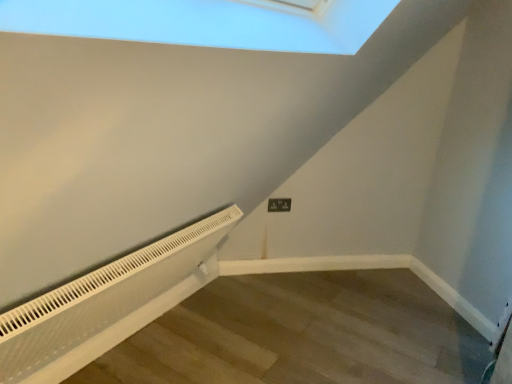
This screenshot has height=384, width=512. What do you see at coordinates (106, 300) in the screenshot?
I see `white textured radiator at lower left` at bounding box center [106, 300].

Locate an element on the screen. This screenshot has height=384, width=512. white textured radiator at lower left is located at coordinates (106, 300).

In order to face white plastic electric outlet at center, should I rotate leftwards or rightwards?

Rotate right and turn 3.498 degrees.

Describe the element at coordinates (279, 205) in the screenshot. I see `white plastic electric outlet at center` at that location.

Find the location of a particular element. The width and height of the screenshot is (512, 384). white plastic electric outlet at center is located at coordinates (279, 205).

Identify the location of white textured radiator at lower left. (106, 300).

From the picture: Considering the positions of objects white plastic electric outlet at center and white textured radiator at lower left in the image provided, who is more to the right, white plastic electric outlet at center or white textured radiator at lower left?

Positioned to the right is white plastic electric outlet at center.

Based on the photo, in the image, is white plastic electric outlet at center positioned in front of or behind white textured radiator at lower left?

In the image, white plastic electric outlet at center appears behind white textured radiator at lower left.

Considering the positions of point (278, 202) and point (106, 344), is point (278, 202) closer or farther from the camera than point (106, 344)?

Clearly, point (278, 202) is more distant from the camera than point (106, 344).

From the image's perspective, which is above, white plastic electric outlet at center or white textured radiator at lower left?

From the image's view, white plastic electric outlet at center is above.

From a real-world perspective, is white plastic electric outlet at center positioned above or below white textured radiator at lower left?

In terms of real-world spatial position, white plastic electric outlet at center is above white textured radiator at lower left.

Considering the sizes of objects white plastic electric outlet at center and white textured radiator at lower left in the image provided, who is wider, white plastic electric outlet at center or white textured radiator at lower left?

white textured radiator at lower left.

Between white plastic electric outlet at center and white textured radiator at lower left, which one has less height?

With less height is white plastic electric outlet at center.

Looking at this image, in terms of size, does white plastic electric outlet at center appear bigger or smaller than white textured radiator at lower left?

Clearly, white plastic electric outlet at center is smaller in size than white textured radiator at lower left.

Is white plastic electric outlet at center positioned beyond the bounds of white textured radiator at lower left?

Indeed, white plastic electric outlet at center is completely outside white textured radiator at lower left.

Is white plastic electric outlet at center next to white textured radiator at lower left?

They are not placed beside each other.

Is white plastic electric outlet at center positioned with its back to white textured radiator at lower left?

No, white plastic electric outlet at center is not facing the opposite direction of white textured radiator at lower left.

What's the angular difference between white plastic electric outlet at center and white textured radiator at lower left's facing directions?

There is a 45.2-degree angle between the facing directions of white plastic electric outlet at center and white textured radiator at lower left.

Looking at this image, could you measure the distance between white plastic electric outlet at center and white textured radiator at lower left?

The distance of white plastic electric outlet at center from white textured radiator at lower left is 1.13 meters.

Where is `electric outlet above the white textured radiator at lower left (from a real-world perspective)`? The height and width of the screenshot is (384, 512). electric outlet above the white textured radiator at lower left (from a real-world perspective) is located at coordinates (279, 205).

Considering the relative positions of white textured radiator at lower left and white plastic electric outlet at center in the image provided, is white textured radiator at lower left to the left of white plastic electric outlet at center from the viewer's perspective?

Yes, white textured radiator at lower left is to the left of white plastic electric outlet at center.

Does white textured radiator at lower left come behind white plastic electric outlet at center?

No, white textured radiator at lower left is closer to the viewer.

Considering the positions of point (201, 244) and point (286, 201), is point (201, 244) closer or farther from the camera than point (286, 201)?

Clearly, point (201, 244) is closer to the camera than point (286, 201).

From the image's perspective, relative to white plastic electric outlet at center, is white textured radiator at lower left above or below?

white textured radiator at lower left is situated lower than white plastic electric outlet at center in the image.

Looking at this image, from a real-world perspective, who is located higher, white textured radiator at lower left or white plastic electric outlet at center?

In real-world perspective, white plastic electric outlet at center is above.

Which of these two, white textured radiator at lower left or white plastic electric outlet at center, is thinner?

With smaller width is white plastic electric outlet at center.

Does white textured radiator at lower left have a lesser height compared to white plastic electric outlet at center?

Incorrect, the height of white textured radiator at lower left does not fall short of that of white plastic electric outlet at center.

Considering the sizes of white textured radiator at lower left and white plastic electric outlet at center in the image, is white textured radiator at lower left bigger or smaller than white plastic electric outlet at center?

Considering their sizes, white textured radiator at lower left takes up more space than white plastic electric outlet at center.

Is white textured radiator at lower left inside the boundaries of white plastic electric outlet at center, or outside?

white textured radiator at lower left is not inside white plastic electric outlet at center, it's outside.

Is white textured radiator at lower left with white plastic electric outlet at center?

There is a gap between white textured radiator at lower left and white plastic electric outlet at center.

Could you tell me if white textured radiator at lower left is turned towards white plastic electric outlet at center?

No, white textured radiator at lower left is not oriented towards white plastic electric outlet at center.

Looking at this image, measure the distance from white textured radiator at lower left to white plastic electric outlet at center.

They are 3.72 feet apart.

You are a GUI agent. You are given a task and a screenshot of the screen. Output one action in this format:
    pyautogui.click(x=<x>, y=<y>)
    Task: Click on the air conditioner in front of the white plastic electric outlet at center
    The height and width of the screenshot is (384, 512).
    Given the screenshot: What is the action you would take?
    pyautogui.click(x=106, y=300)

The width and height of the screenshot is (512, 384). What are the coordinates of `electric outlet above the white textured radiator at lower left (from a real-world perspective)` in the screenshot? It's located at (279, 205).

Locate an element on the screen. electric outlet that appears above the white textured radiator at lower left (from the image's perspective) is located at coordinates (279, 205).